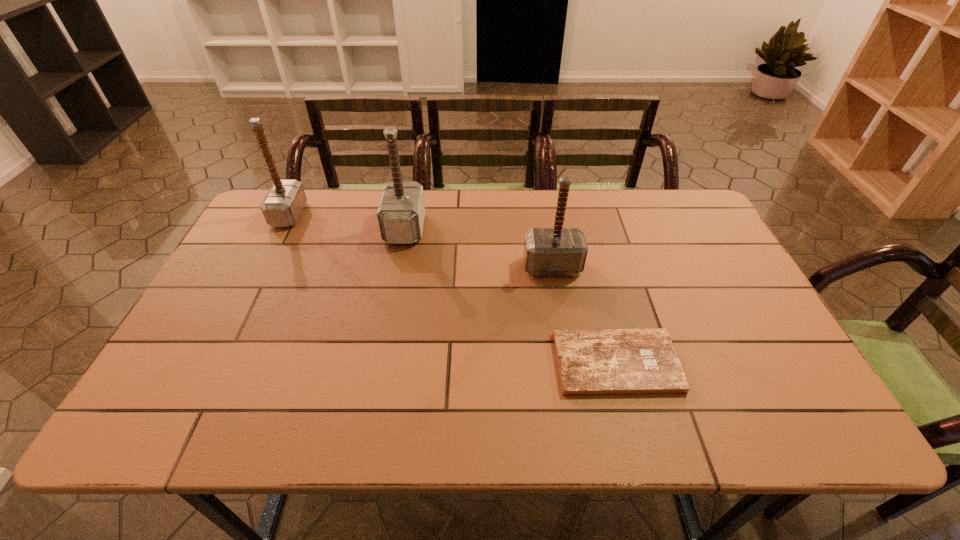
Identify the location of hammer that is the second closest to the nearest object. [x=401, y=212].

This screenshot has width=960, height=540. I want to click on free space that satisfies the following two spatial constraints: 1. for striking with the head of the rightmost hammer; 2. on the right side of the second hammer from right to left, so click(397, 267).

I want to click on blank area in the image that satisfies the following two spatial constraints: 1. on the striking surface of the third farthest object; 2. on the left side of the leftmost object, so click(263, 267).

I want to click on vacant area in the image that satisfies the following two spatial constraints: 1. for striking with the head of the second object from left to right; 2. on the back side of the Bible, so click(x=379, y=363).

Where is `vacant region that satisfies the following two spatial constraints: 1. for striking with the head of the second nearest object; 2. on the right side of the second hammer from left to right`? vacant region that satisfies the following two spatial constraints: 1. for striking with the head of the second nearest object; 2. on the right side of the second hammer from left to right is located at coordinates (397, 267).

Find the location of a particular element. free location that satisfies the following two spatial constraints: 1. for striking with the head of the second hammer from right to left; 2. on the right side of the second nearest object is located at coordinates click(x=397, y=267).

This screenshot has width=960, height=540. I want to click on vacant space that satisfies the following two spatial constraints: 1. for striking with the head of the third object from right to left; 2. on the back side of the shortest object, so click(379, 363).

Identify the location of vacant space that satisfies the following two spatial constraints: 1. for striking with the head of the second object from left to right; 2. on the right side of the second nearest object. Image resolution: width=960 pixels, height=540 pixels. (397, 267).

The height and width of the screenshot is (540, 960). In order to click on free space that satisfies the following two spatial constraints: 1. on the front side of the rightmost hammer; 2. on the right side of the Bible in this screenshot , I will do click(x=568, y=363).

In order to click on vacant space that satisfies the following two spatial constraints: 1. on the striking surface of the leftmost object; 2. on the right side of the Bible in this screenshot , I will do `click(215, 363)`.